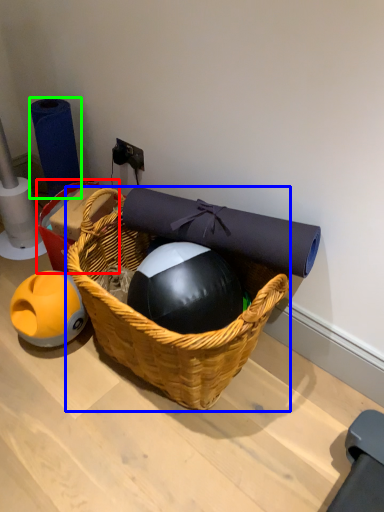
Question: Based on their relative distances, which object is nearer to basket (highlighted by a red box)? Choose from picnic basket (highlighted by a blue box) and toilet paper (highlighted by a green box).

Choices:
 (A) picnic basket
 (B) toilet paper

Answer: (B)